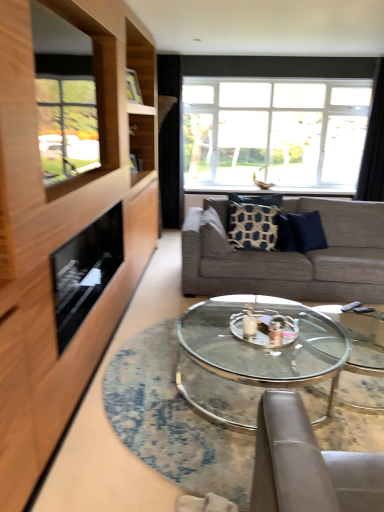
Question: Is there a large distance between wooden frame at left and patterned fabric pillow at center, marked as the first pillow in a left-to-right arrangement?

Choices:
 (A) no
 (B) yes

Answer: (B)

Question: From the image's perspective, would you say wooden frame at left is shown under patterned fabric pillow at center, positioned as the 2th pillow in right-to-left order?

Choices:
 (A) yes
 (B) no

Answer: (B)

Question: Is patterned fabric pillow at center, positioned as the 2th pillow in right-to-left order, at the back of wooden frame at left?

Choices:
 (A) yes
 (B) no

Answer: (B)

Question: From a real-world perspective, is wooden frame at left located beneath patterned fabric pillow at center, positioned as the 2th pillow in right-to-left order?

Choices:
 (A) yes
 (B) no

Answer: (B)

Question: Can you confirm if wooden frame at left is smaller than patterned fabric pillow at center, marked as the first pillow in a left-to-right arrangement?

Choices:
 (A) no
 (B) yes

Answer: (A)

Question: Is black fabric curtain at upper right, marked as the first curtain in a right-to-left arrangement, to the left or to the right of blue textured pillow at center, the second pillow in the left-to-right sequence, in the image?

Choices:
 (A) right
 (B) left

Answer: (A)

Question: In terms of size, does black fabric curtain at upper right, which is the second curtain from left to right, appear bigger or smaller than blue textured pillow at center, the second pillow in the left-to-right sequence?

Choices:
 (A) big
 (B) small

Answer: (A)

Question: Is black fabric curtain at upper right, which is the second curtain from left to right, inside or outside of blue textured pillow at center, arranged as the 1th pillow when viewed from the right?

Choices:
 (A) outside
 (B) inside

Answer: (A)

Question: Considering their positions, is black fabric curtain at upper right, which is the second curtain from left to right, located in front of or behind blue textured pillow at center, arranged as the 1th pillow when viewed from the right?

Choices:
 (A) front
 (B) behind

Answer: (B)

Question: Looking at the image, does transparent glass coffee table at center seem bigger or smaller compared to blue textured pillow at center, arranged as the 1th pillow when viewed from the right?

Choices:
 (A) small
 (B) big

Answer: (B)

Question: In terms of width, does transparent glass coffee table at center look wider or thinner when compared to blue textured pillow at center, the second pillow in the left-to-right sequence?

Choices:
 (A) thin
 (B) wide

Answer: (B)

Question: Is transparent glass coffee table at center taller or shorter than blue textured pillow at center, arranged as the 1th pillow when viewed from the right?

Choices:
 (A) tall
 (B) short

Answer: (B)

Question: Is transparent glass coffee table at center to the left or to the right of blue textured pillow at center, the second pillow in the left-to-right sequence, in the image?

Choices:
 (A) right
 (B) left

Answer: (A)

Question: Considering the positions of transparent glass table at center and black glass fireplace at left in the image, is transparent glass table at center wider or thinner than black glass fireplace at left?

Choices:
 (A) thin
 (B) wide

Answer: (B)

Question: Is transparent glass table at center inside the boundaries of black glass fireplace at left, or outside?

Choices:
 (A) inside
 (B) outside

Answer: (B)